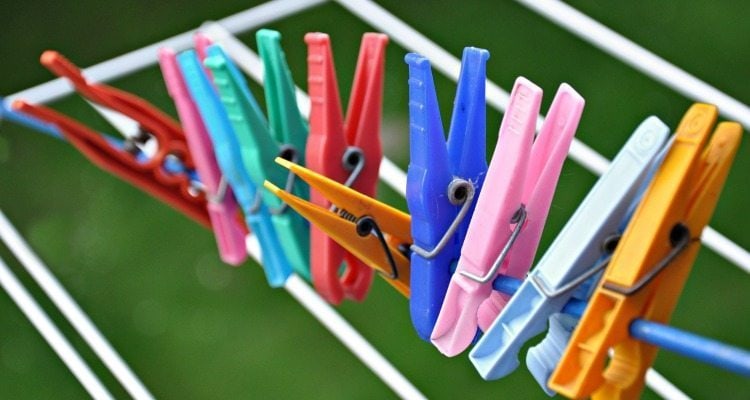
Identify the location of 2 white cords on lower left. Image resolution: width=750 pixels, height=400 pixels. (100, 355), (88, 376).